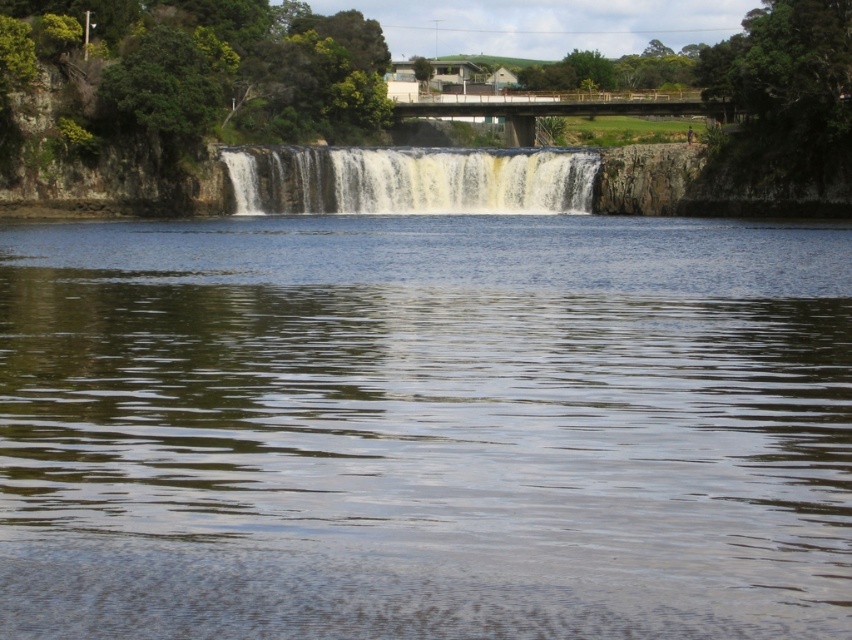
Question: Where is greenish reflective water at center located in relation to white frothy water at center in the image?

Choices:
 (A) right
 (B) left

Answer: (A)

Question: Which object is closer to the camera taking this photo?

Choices:
 (A) greenish reflective water at center
 (B) white frothy water at center

Answer: (A)

Question: Which object appears farthest from the camera in this image?

Choices:
 (A) white frothy water at center
 (B) greenish reflective water at center

Answer: (A)

Question: Where is greenish reflective water at center located in relation to white frothy water at center in the image?

Choices:
 (A) below
 (B) above

Answer: (A)

Question: Is the position of greenish reflective water at center less distant than that of white frothy water at center?

Choices:
 (A) no
 (B) yes

Answer: (B)

Question: Which point is farther to the camera?

Choices:
 (A) white frothy water at center
 (B) greenish reflective water at center

Answer: (A)